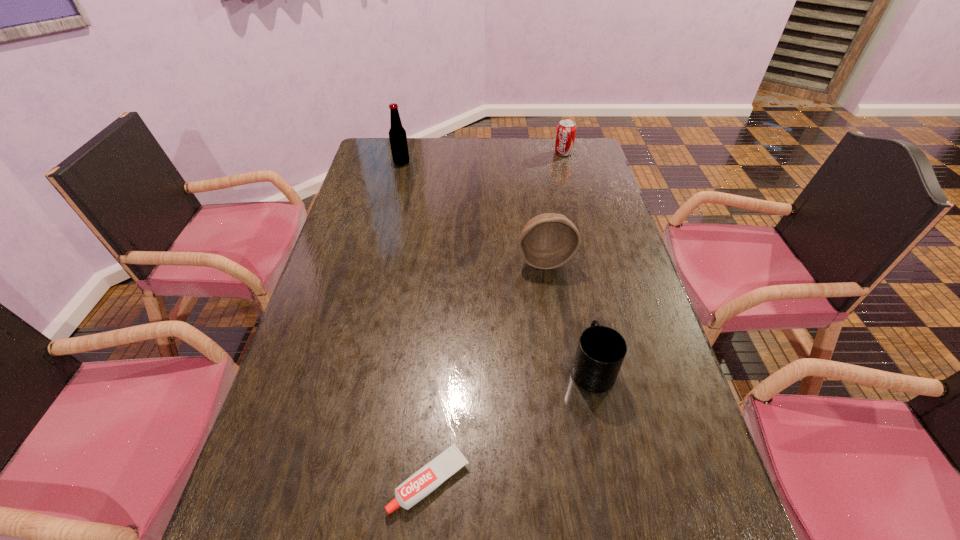
Locate an element on the screen. free spot between the fourth farthest object and the shortest object is located at coordinates (511, 425).

In order to click on vacant space that's between the bowl and the beer bottle in this screenshot , I will do `click(473, 211)`.

I want to click on blank region between the shortest object and the fourth farthest object, so click(x=511, y=425).

Find the location of `blank region between the farthest object and the bowl`. blank region between the farthest object and the bowl is located at coordinates (554, 206).

Where is `vacant space in between the fourth farthest object and the bowl`? vacant space in between the fourth farthest object and the bowl is located at coordinates (568, 315).

You are a GUI agent. You are given a task and a screenshot of the screen. Output one action in this format:
    pyautogui.click(x=<x>, y=<y>)
    Task: Click on the empty location between the toothpaste and the leftmost object
    
    Given the screenshot: What is the action you would take?
    pyautogui.click(x=416, y=322)

Identify which object is the second nearest to the leftmost object. Please provide its 2D coordinates. Your answer should be formatted as a tuple, i.e. [(x, y)], where the tuple contains the x and y coordinates of a point satisfying the conditions above.

[(547, 241)]

Choose which object is the second nearest neighbor to the tallest object. Please provide its 2D coordinates. Your answer should be formatted as a tuple, i.e. [(x, y)], where the tuple contains the x and y coordinates of a point satisfying the conditions above.

[(547, 241)]